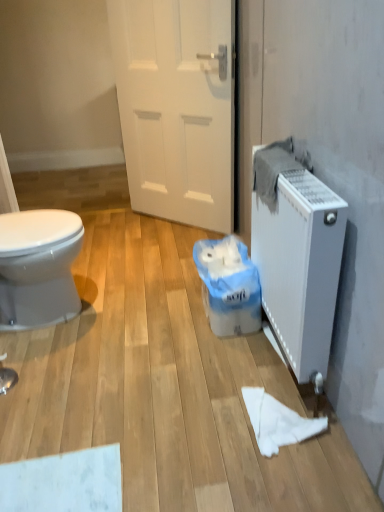
Locate an element on the screen. free space in front of white plastic bag at center is located at coordinates (211, 361).